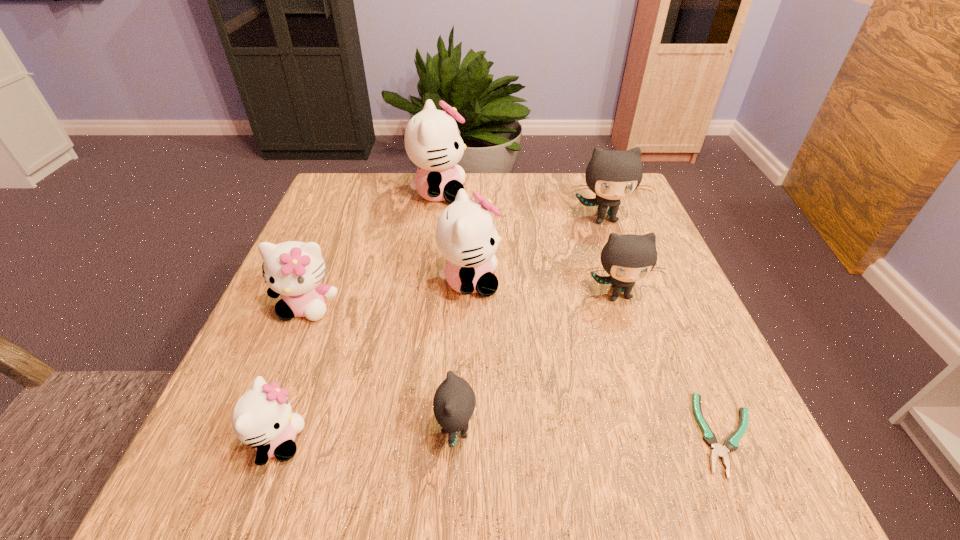
This screenshot has height=540, width=960. What are the coordinates of `teal pliers` in the screenshot? It's located at (731, 443).

I want to click on vacant area situated on the front-facing side of the biggest white kitten, so click(x=549, y=193).

Where is `vacant area located 0.340m on the front-facing side of the third smallest white kitten`? The image size is (960, 540). vacant area located 0.340m on the front-facing side of the third smallest white kitten is located at coordinates (662, 281).

You are a GUI agent. You are given a task and a screenshot of the screen. Output one action in this format:
    pyautogui.click(x=<x>, y=<y>)
    Task: Click on the free space located 0.100m on the front-facing side of the farthest gray kitten
    
    Given the screenshot: What is the action you would take?
    pyautogui.click(x=618, y=257)

Where is `vacant space located 0.090m on the front-facing side of the second smallest white kitten`? vacant space located 0.090m on the front-facing side of the second smallest white kitten is located at coordinates (283, 364).

The width and height of the screenshot is (960, 540). Find the location of `blank space located on the front-facing side of the second biggest gray kitten`. blank space located on the front-facing side of the second biggest gray kitten is located at coordinates (659, 415).

The height and width of the screenshot is (540, 960). In order to click on vacant region located 0.140m on the front-facing side of the smallest white kitten in this screenshot , I will do `click(397, 441)`.

What are the coordinates of `vacant space located on the front-facing side of the nearest gray kitten` in the screenshot? It's located at (707, 430).

At what (x,y) coordinates should I click in order to perform the action: click on vacant area situated 0.070m on the back of the pliers. Please return your answer as a coordinate pair (x, y). The width and height of the screenshot is (960, 540). Looking at the image, I should click on (694, 360).

In order to click on pliers present at the near edge in this screenshot , I will do `click(731, 443)`.